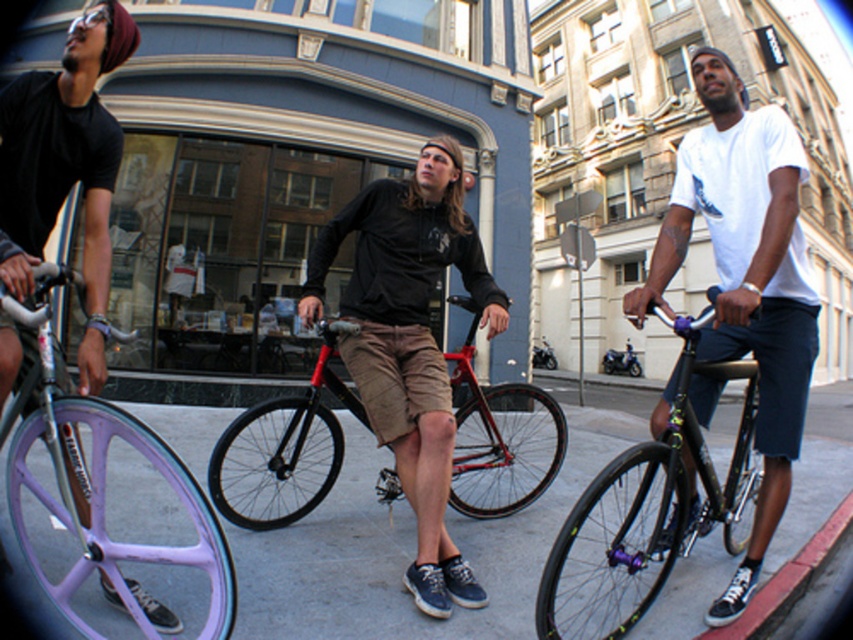
You are a delivery person who needs to choose between the purple matte bicycle wheel at lower left and the matte black bicycle at left for a quick delivery. Considering their heights, which bicycle would be easier to mount?

The purple matte bicycle wheel at lower left has a lesser height compared to the matte black bicycle at left, so it would be easier to mount because lower height requires less effort.

Where is the shiny black frame at right located in the image?

The shiny black frame at right is located at the point with coordinates (647, 509).

Where is the purple matte bicycle wheel at lower left located in the image?

The purple matte bicycle wheel at lower left is located at point (412, 547) in the image.